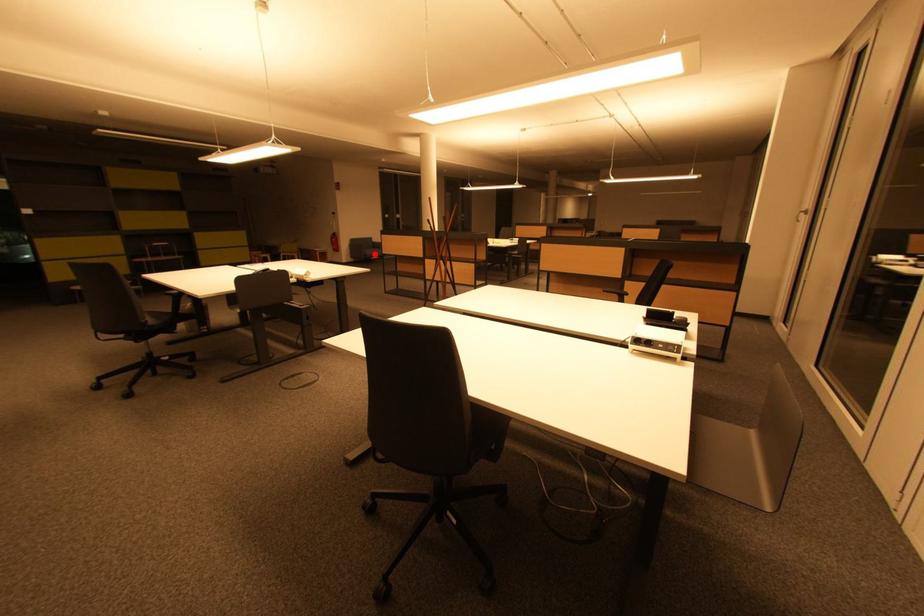
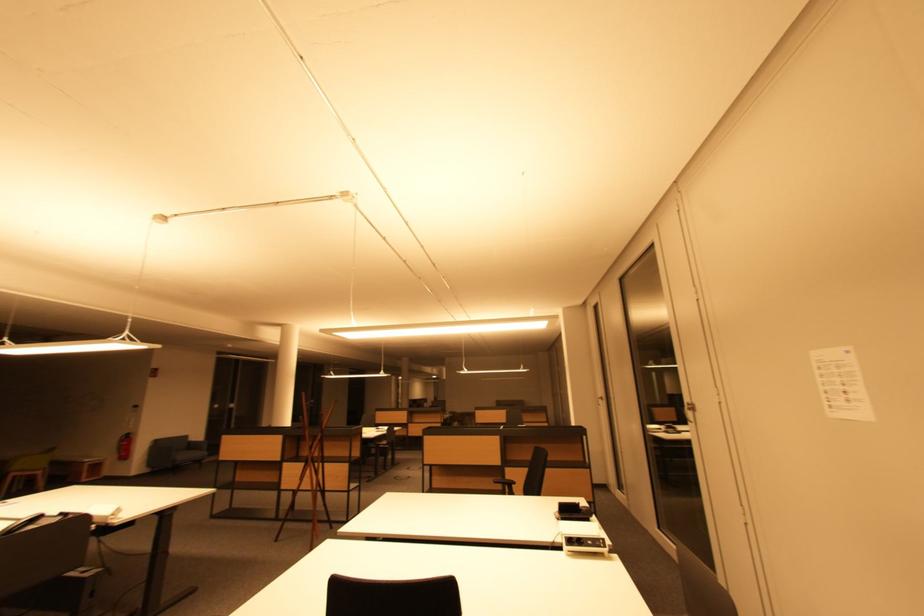
In the second image, find the point that corresponds to the highlighted location in the first image.

(188, 458)